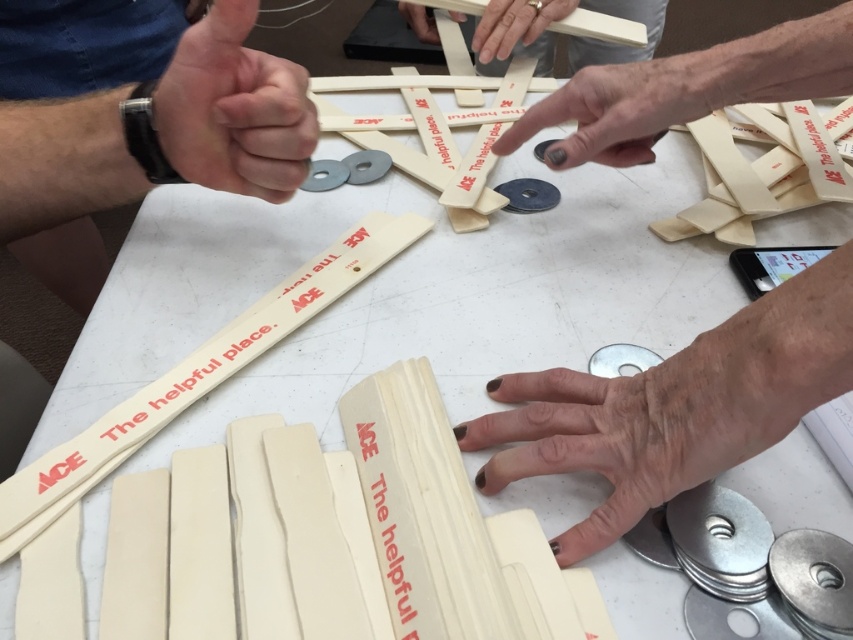
Is matte black hand at upper left above white matte wood at upper center?

Actually, matte black hand at upper left is below white matte wood at upper center.

Does point (215, 35) come farther from viewer compared to point (405, 8)?

That is False.

Which is behind, point (258, 182) or point (456, 13)?

The point (456, 13) is more distant.

The image size is (853, 640). What are the coordinates of `matte black hand at upper left` in the screenshot? It's located at (234, 109).

Which of these two, matte white finger at upper center or matte wood stick at upper center, stands taller?

With more height is matte wood stick at upper center.

Does point (643, 115) come behind point (502, 29)?

No, (643, 115) is closer to viewer.

Identify the location of matte white finger at upper center. This screenshot has height=640, width=853. (619, 109).

Looking at this image, between matte white hand at upper left and matte white wood at upper center, which one appears on the left side from the viewer's perspective?

matte white hand at upper left

The height and width of the screenshot is (640, 853). I want to click on matte white hand at upper left, so click(x=234, y=109).

Identify the location of matte white hand at upper left. (234, 109).